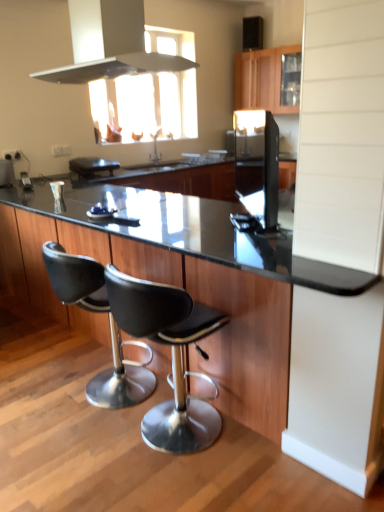
This screenshot has height=512, width=384. What are the coordinates of `vacant space underneath black leather stool at center, positioned as the second chair in right-to-left order (from a real-world perspective)` in the screenshot? It's located at (92, 402).